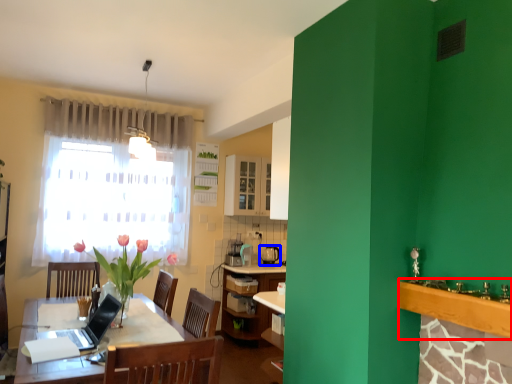
Question: Which object appears closest to the camera in this image, counter top (highlighted by a red box) or appliance (highlighted by a blue box)?

Choices:
 (A) counter top
 (B) appliance

Answer: (A)